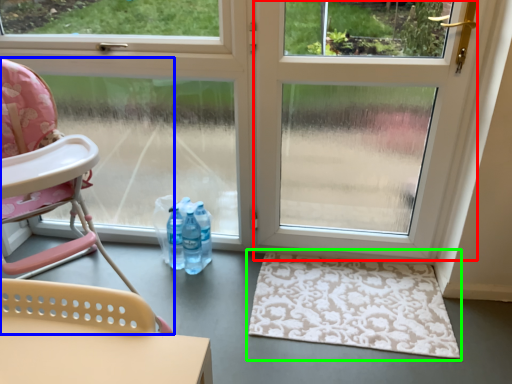
Question: Considering the real-world distances, which object is closest to screen door (highlighted by a red box)? chair (highlighted by a blue box) or doormat (highlighted by a green box).

Choices:
 (A) chair
 (B) doormat

Answer: (B)